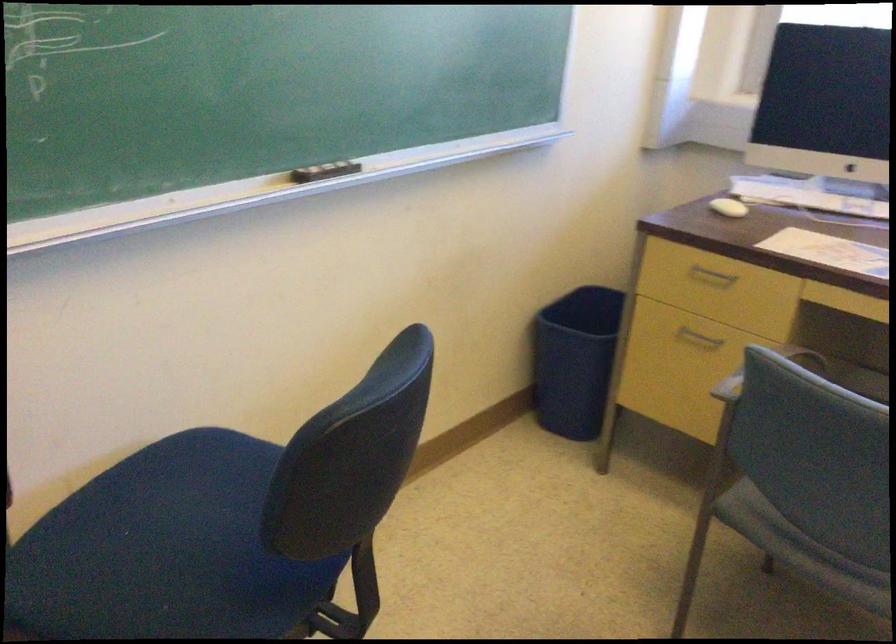
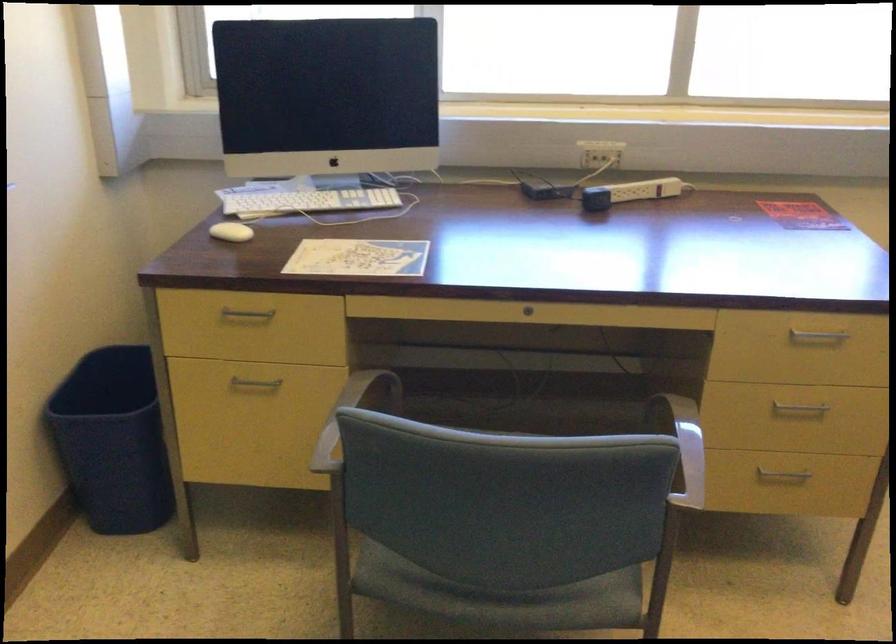
Find the pixel in the second image that matches the point at 702,333 in the first image.

(254, 384)